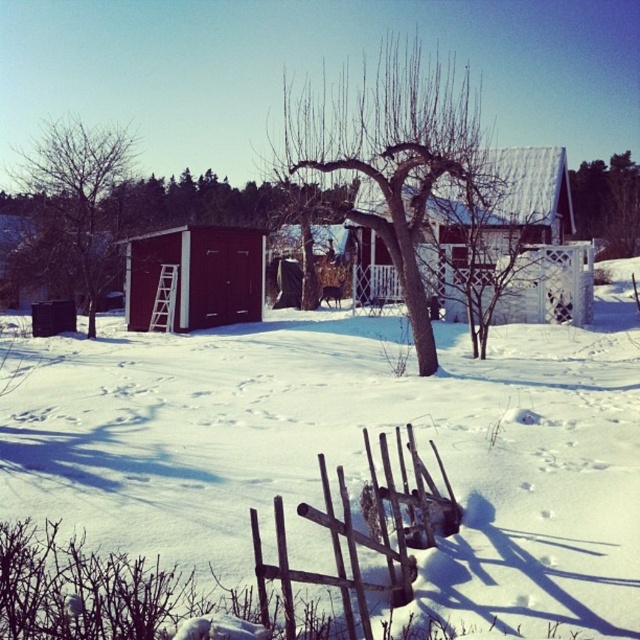
You are standing at the edge of the snowy field and want to take a photo of the dark brown wood shed at center and the green leafy tree at upper right. Which object will appear larger in the photo?

The dark brown wood shed at center will appear larger in the photo because it is closer to you than the green leafy tree at upper right.

You are planning to build a new garden shed in your backyard. You want to ensure it is larger than the existing dark brown wood shed at center but still smaller than the green leafy tree at upper right. Is this possible based on the scene?

Yes, it is possible to build a new garden shed larger than the dark brown wood shed at center but smaller than the green leafy tree at upper right since the green leafy tree at upper right is larger than the dark brown wood shed at center.